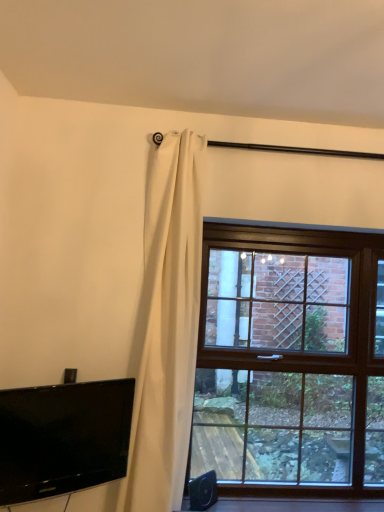
Question: Can you confirm if brown wooden window at right is thinner than black glossy tv at lower left?

Choices:
 (A) no
 (B) yes

Answer: (A)

Question: Considering the relative sizes of brown wooden window at right and black glossy tv at lower left in the image provided, is brown wooden window at right wider than black glossy tv at lower left?

Choices:
 (A) no
 (B) yes

Answer: (B)

Question: Is black glossy tv at lower left completely or partially inside brown wooden window at right?

Choices:
 (A) yes
 (B) no

Answer: (B)

Question: Is brown wooden window at right at the left side of black glossy tv at lower left?

Choices:
 (A) yes
 (B) no

Answer: (B)

Question: Is brown wooden window at right positioned beyond the bounds of black glossy tv at lower left?

Choices:
 (A) no
 (B) yes

Answer: (B)

Question: From a real-world perspective, is brown wooden window at right physically located above or below black glossy tv at lower left?

Choices:
 (A) below
 (B) above

Answer: (B)

Question: Is brown wooden window at right to the left or to the right of black glossy tv at lower left in the image?

Choices:
 (A) right
 (B) left

Answer: (A)

Question: In terms of size, does brown wooden window at right appear bigger or smaller than black glossy tv at lower left?

Choices:
 (A) small
 (B) big

Answer: (B)

Question: Is brown wooden window at right in front of or behind black glossy tv at lower left in the image?

Choices:
 (A) front
 (B) behind

Answer: (B)

Question: From a real-world perspective, is white matte curtain at upper left physically located above or below black glossy tv at lower left?

Choices:
 (A) above
 (B) below

Answer: (A)

Question: Is white matte curtain at upper left in front of or behind black glossy tv at lower left in the image?

Choices:
 (A) behind
 (B) front

Answer: (A)

Question: Considering the positions of point (119, 486) and point (31, 499), is point (119, 486) closer or farther from the camera than point (31, 499)?

Choices:
 (A) closer
 (B) farther

Answer: (B)

Question: Looking at the image, does white matte curtain at upper left seem bigger or smaller compared to black glossy tv at lower left?

Choices:
 (A) small
 (B) big

Answer: (B)

Question: Is point (327, 460) closer or farther from the camera than point (147, 344)?

Choices:
 (A) closer
 (B) farther

Answer: (B)

Question: Based on their positions, is brown wooden window at right located to the left or right of white matte curtain at upper left?

Choices:
 (A) left
 (B) right

Answer: (B)